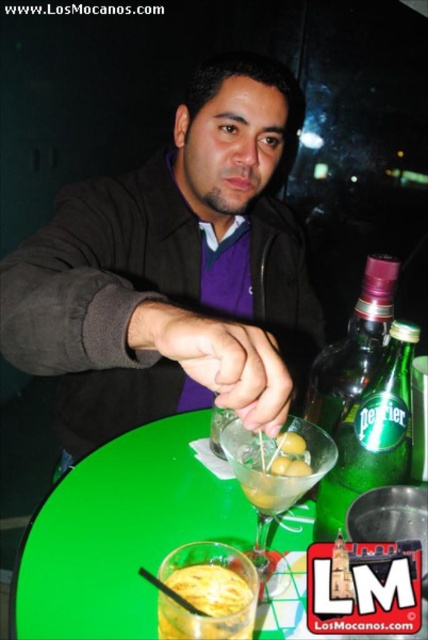
Question: Among these points, which one is nearest to the camera?

Choices:
 (A) (211, 628)
 (B) (379, 461)
 (C) (264, 442)
 (D) (362, 301)

Answer: (A)

Question: Can you confirm if matte black jacket at center is smaller than green plastic table at center?

Choices:
 (A) no
 (B) yes

Answer: (A)

Question: Which point is farther from the camera taking this photo?

Choices:
 (A) (250, 522)
 (B) (317, 477)
 (C) (225, 595)
 (D) (338, 394)

Answer: (A)

Question: Is green plastic table at center closer to the viewer compared to yellow frothy liquid at lower left?

Choices:
 (A) yes
 (B) no

Answer: (B)

Question: Is transparent glass martini at center below yellow frothy liquid at lower left?

Choices:
 (A) yes
 (B) no

Answer: (B)

Question: Considering the real-world distances, which object is farthest from the transparent glass martini at center?

Choices:
 (A) green plastic table at center
 (B) yellow frothy liquid at lower left
 (C) green glass bottle at right
 (D) green glass bottle at center

Answer: (A)